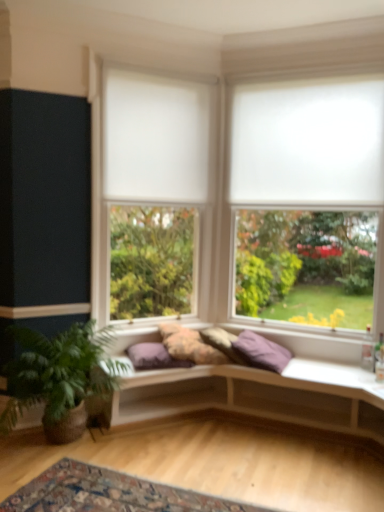
The height and width of the screenshot is (512, 384). What do you see at coordinates (261, 351) in the screenshot?
I see `purple fabric pillow at center, arranged as the 3th pillow when viewed from the left` at bounding box center [261, 351].

Locate an element on the screen. wooden studio couch at center is located at coordinates (257, 395).

Measure the distance between white matte curtain at upper center and camera.

The distance of white matte curtain at upper center from camera is 3.26 meters.

This screenshot has width=384, height=512. Describe the element at coordinates (189, 345) in the screenshot. I see `fluffy fabric pillow at center, marked as the first pillow in a left-to-right arrangement` at that location.

Measure the distance between point [171,355] and camera.

They are 3.27 meters apart.

At what (x,y) coordinates should I click in order to perform the action: click on green leafy plant at lower left. Please return your answer as a coordinate pair (x, y). Looking at the image, I should click on (60, 377).

You are a GUI agent. You are given a task and a screenshot of the screen. Output one action in this format:
    pyautogui.click(x=<x>, y=<y>)
    Task: Click on the 2nd window positioned above the purple fabric pillow at center, which appears as the second pillow when viewed from the right (from the image's perspective)
    This screenshot has width=384, height=512.
    Given the screenshot: What is the action you would take?
    pyautogui.click(x=150, y=153)

Which object is positioned more to the left, purple fabric pillow at center, which appears as the second pillow when viewed from the right, or white matte window at center, the 1th window from the left?

white matte window at center, the 1th window from the left.

Can white matte window at center, which is the 2th window in right-to-left order, be found inside purple fabric pillow at center, which is counted as the 2th pillow, starting from the left?

No, purple fabric pillow at center, which is counted as the 2th pillow, starting from the left, does not contain white matte window at center, which is the 2th window in right-to-left order.

Does point (224, 345) come closer to viewer compared to point (110, 71)?

No.

Find the location of a particular element. The width and height of the screenshot is (384, 512). pillow that is under the purple fabric pillow at center, which appears as the second pillow when viewed from the right (from a real-world perspective) is located at coordinates (261, 351).

Which object is wider, purple fabric pillow at center, which appears as the second pillow when viewed from the right, or purple fabric pillow at center, which is the first pillow from right to left?

Wider between the two is purple fabric pillow at center, which is the first pillow from right to left.

Is purple fabric pillow at center, which is counted as the 2th pillow, starting from the left, positioned behind purple fabric pillow at center, arranged as the 3th pillow when viewed from the left?

Yes, it is behind purple fabric pillow at center, arranged as the 3th pillow when viewed from the left.

Is fluffy fabric pillow at center, marked as the first pillow in a left-to-right arrangement, positioned far away from white matte window at center, which is the 2th window in right-to-left order?

Absolutely, fluffy fabric pillow at center, marked as the first pillow in a left-to-right arrangement, is distant from white matte window at center, which is the 2th window in right-to-left order.

Relative to white matte window at center, which is the 2th window in right-to-left order, is fluffy fabric pillow at center, marked as the first pillow in a left-to-right arrangement, in front or behind?

Visually, fluffy fabric pillow at center, marked as the first pillow in a left-to-right arrangement, is located behind white matte window at center, which is the 2th window in right-to-left order.

Is fluffy fabric pillow at center, marked as the first pillow in a left-to-right arrangement, bigger than white matte window at center, which is the 2th window in right-to-left order?

Incorrect, fluffy fabric pillow at center, marked as the first pillow in a left-to-right arrangement, is not larger than white matte window at center, which is the 2th window in right-to-left order.

Which is nearer, (x=286, y=298) or (x=119, y=483)?

Clearly, point (x=286, y=298) is more distant from the camera than point (x=119, y=483).

Considering the relative sizes of white matte window at upper right, marked as the second window in a left-to-right arrangement, and carpeted rug at lower center in the image provided, is white matte window at upper right, marked as the second window in a left-to-right arrangement, bigger than carpeted rug at lower center?

Correct, white matte window at upper right, marked as the second window in a left-to-right arrangement, is larger in size than carpeted rug at lower center.

How many degrees apart are the facing directions of white matte window at upper right, marked as the second window in a left-to-right arrangement, and carpeted rug at lower center?

The angular difference between white matte window at upper right, marked as the second window in a left-to-right arrangement, and carpeted rug at lower center is 89.9 degrees.

From a real-world perspective, does white matte window at upper right, marked as the second window in a left-to-right arrangement, sit lower than carpeted rug at lower center?

No, from a real-world perspective, white matte window at upper right, marked as the second window in a left-to-right arrangement, is not below carpeted rug at lower center.

Is the position of purple fabric pillow at center, arranged as the 3th pillow when viewed from the left, less distant than that of purple fabric pillow at center, which appears as the second pillow when viewed from the right?

Yes, it is.

Based on the photo, which object is thinner, purple fabric pillow at center, which is the first pillow from right to left, or purple fabric pillow at center, which is counted as the 2th pillow, starting from the left?

Thinner between the two is purple fabric pillow at center, which is counted as the 2th pillow, starting from the left.

Between purple fabric pillow at center, arranged as the 3th pillow when viewed from the left, and purple fabric pillow at center, which appears as the second pillow when viewed from the right, which one has less height?

With less height is purple fabric pillow at center, which appears as the second pillow when viewed from the right.

From a real-world perspective, is purple fabric pillow at center, which is the first pillow from right to left, positioned above or below purple fabric pillow at center, which is counted as the 2th pillow, starting from the left?

purple fabric pillow at center, which is the first pillow from right to left, is situated lower than purple fabric pillow at center, which is counted as the 2th pillow, starting from the left, in the real world.

Considering the sizes of objects white matte curtain at upper center and green leafy plant at lower left in the image provided, who is bigger, white matte curtain at upper center or green leafy plant at lower left?

Bigger between the two is green leafy plant at lower left.

In the scene shown: Is white matte curtain at upper center at the right side of green leafy plant at lower left?

Indeed, white matte curtain at upper center is positioned on the right side of green leafy plant at lower left.

Considering the sizes of objects white matte curtain at upper center and green leafy plant at lower left in the image provided, who is wider, white matte curtain at upper center or green leafy plant at lower left?

Wider between the two is green leafy plant at lower left.

Measure the distance between white matte window at upper right, which is the 1th window in right-to-left order, and purple fabric pillow at center, which is the first pillow from right to left.

A distance of 1.45 meters exists between white matte window at upper right, which is the 1th window in right-to-left order, and purple fabric pillow at center, which is the first pillow from right to left.

Considering the sizes of white matte window at upper right, marked as the second window in a left-to-right arrangement, and purple fabric pillow at center, which is the first pillow from right to left, in the image, is white matte window at upper right, marked as the second window in a left-to-right arrangement, taller or shorter than purple fabric pillow at center, which is the first pillow from right to left,?

Considering their sizes, white matte window at upper right, marked as the second window in a left-to-right arrangement, has more height than purple fabric pillow at center, which is the first pillow from right to left.

Is white matte window at upper right, which is the 1th window in right-to-left order, positioned in front of purple fabric pillow at center, which is the first pillow from right to left?

No, white matte window at upper right, which is the 1th window in right-to-left order, is further to the viewer.

Considering the relative sizes of white matte window at upper right, which is the 1th window in right-to-left order, and purple fabric pillow at center, which is the first pillow from right to left, in the image provided, is white matte window at upper right, which is the 1th window in right-to-left order, smaller than purple fabric pillow at center, which is the first pillow from right to left,?

No, white matte window at upper right, which is the 1th window in right-to-left order, is not smaller than purple fabric pillow at center, which is the first pillow from right to left.

Image resolution: width=384 pixels, height=512 pixels. In order to click on pillow that is the 2nd object to the right of the white matte window at center, the 1th window from the left, starting at the anchor in this screenshot , I will do `click(223, 343)`.

The height and width of the screenshot is (512, 384). There is a purple fabric pillow at center, arranged as the 3th pillow when viewed from the left. What are the coordinates of `the 1st pillow above it (from a real-world perspective)` in the screenshot? It's located at (223, 343).

Based on their spatial positions, is green leafy plant at lower left or carpeted rug at lower center further from fluffy fabric pillow at center, marked as the first pillow in a left-to-right arrangement?

carpeted rug at lower center is further to fluffy fabric pillow at center, marked as the first pillow in a left-to-right arrangement.

Looking at the image, which one is located further to wooden studio couch at center, white matte window at upper right, which is the 1th window in right-to-left order, or purple fabric pillow at center, which appears as the second pillow when viewed from the right?

Among the two, white matte window at upper right, which is the 1th window in right-to-left order, is located further to wooden studio couch at center.

Consider the image. Considering their positions, is carpeted rug at lower center positioned further to wooden studio couch at center than white matte curtain at upper center?

white matte curtain at upper center lies further to wooden studio couch at center than the other object.

Estimate the real-world distances between objects in this image. Which object is closer to carpeted rug at lower center, purple fabric pillow at center, which appears as the second pillow when viewed from the right, or wooden studio couch at center?

The object closer to carpeted rug at lower center is wooden studio couch at center.

Which object lies further to the anchor point fluffy fabric pillow at center, marked as the first pillow in a left-to-right arrangement, green leafy plant at lower left or white matte blind at upper right?

Based on the image, white matte blind at upper right appears to be further to fluffy fabric pillow at center, marked as the first pillow in a left-to-right arrangement.

Which object lies further to the anchor point carpeted rug at lower center, green leafy plant at lower left or fluffy fabric pillow at center, which is the third pillow in right-to-left order?

fluffy fabric pillow at center, which is the third pillow in right-to-left order, is positioned further to the anchor carpeted rug at lower center.

Considering their positions, is white matte curtain at upper center positioned further to carpeted rug at lower center than white matte window at center, which is the 2th window in right-to-left order?

Based on the image, white matte curtain at upper center appears to be further to carpeted rug at lower center.

Looking at the image, which one is located closer to white matte window at center, which is the 2th window in right-to-left order, purple fabric pillow at center, which appears as the second pillow when viewed from the right, or carpeted rug at lower center?

purple fabric pillow at center, which appears as the second pillow when viewed from the right.

The width and height of the screenshot is (384, 512). In order to click on houseplant that lies between white matte blind at upper right and wooden studio couch at center from top to bottom in this screenshot , I will do `click(60, 377)`.

What are the coordinates of `window between white matte window at center, the 1th window from the left, and fluffy fabric pillow at center, which is the third pillow in right-to-left order, in the up-down direction` in the screenshot? It's located at (310, 190).

You are a GUI agent. You are given a task and a screenshot of the screen. Output one action in this format:
    pyautogui.click(x=<x>, y=<y>)
    Task: Click on the houseplant between white matte window at center, which is the 2th window in right-to-left order, and wooden studio couch at center in the up-down direction
    The image size is (384, 512).
    Given the screenshot: What is the action you would take?
    (60, 377)

Locate an element on the screen. houseplant between white matte curtain at upper center and wooden studio couch at center in the vertical direction is located at coordinates point(60,377).